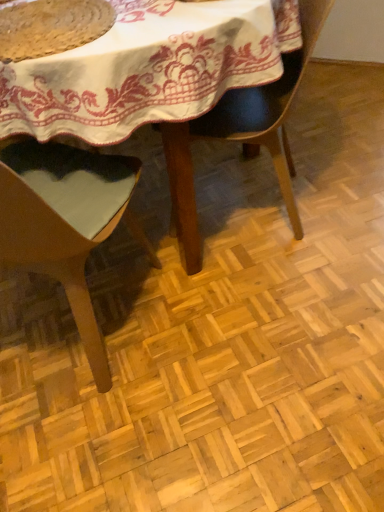
The height and width of the screenshot is (512, 384). What are the coordinates of `empty space that is to the right of rustic woven mat at upper left` in the screenshot? It's located at point(168,24).